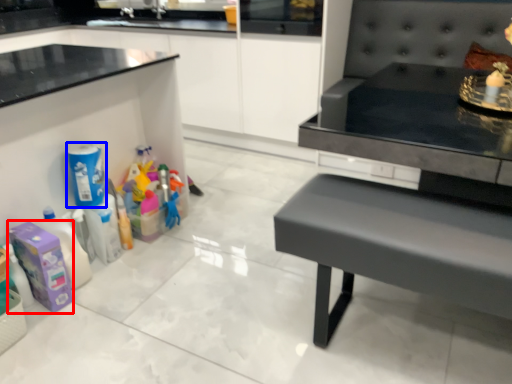
Question: Which of the following is the farthest to the observer, cleaning product (highlighted by a red box) or cleaning product (highlighted by a blue box)?

Choices:
 (A) cleaning product
 (B) cleaning product

Answer: (B)